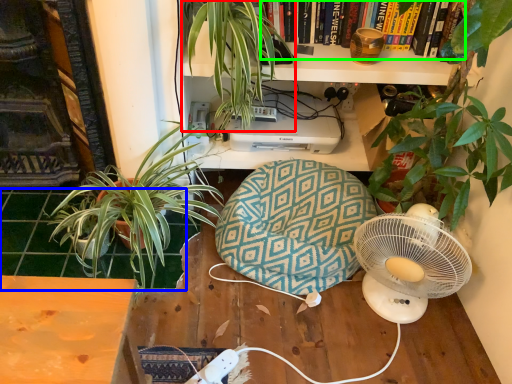
Question: Which object is positioned farthest from houseplant (highlighted by a red box)? Select from tile (highlighted by a blue box) and book (highlighted by a green box).

Choices:
 (A) tile
 (B) book

Answer: (A)